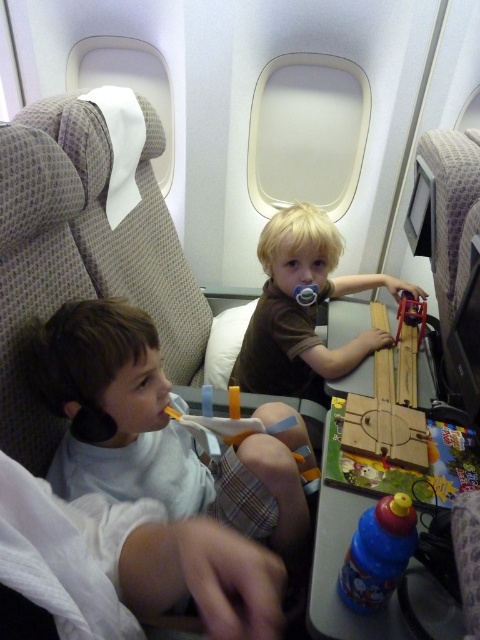
Which of these two, white soft toothbrush at left or brown matte shirt at center, stands taller?

With more height is brown matte shirt at center.

Which is below, white soft toothbrush at left or brown matte shirt at center?

white soft toothbrush at left

Does point (149, 465) come behind point (345, 285)?

No, it is not.

The image size is (480, 640). What are the coordinates of `white soft toothbrush at left` in the screenshot? It's located at (157, 432).

Between white soft toothbrush at left and wooden train at center, which one appears on the left side from the viewer's perspective?

From the viewer's perspective, white soft toothbrush at left appears more on the left side.

Which is below, white soft toothbrush at left or wooden train at center?

white soft toothbrush at left is below.

The height and width of the screenshot is (640, 480). Describe the element at coordinates (157, 432) in the screenshot. I see `white soft toothbrush at left` at that location.

Locate an element on the screen. The image size is (480, 640). white soft toothbrush at left is located at coordinates (157, 432).

Who is more forward, (179, 442) or (369, 557)?

Point (369, 557) is in front.

Is white soft toothbrush at left shorter than blue plastic water bottle at lower center?

No.

Where is `white soft toothbrush at left`? white soft toothbrush at left is located at coordinates (157, 432).